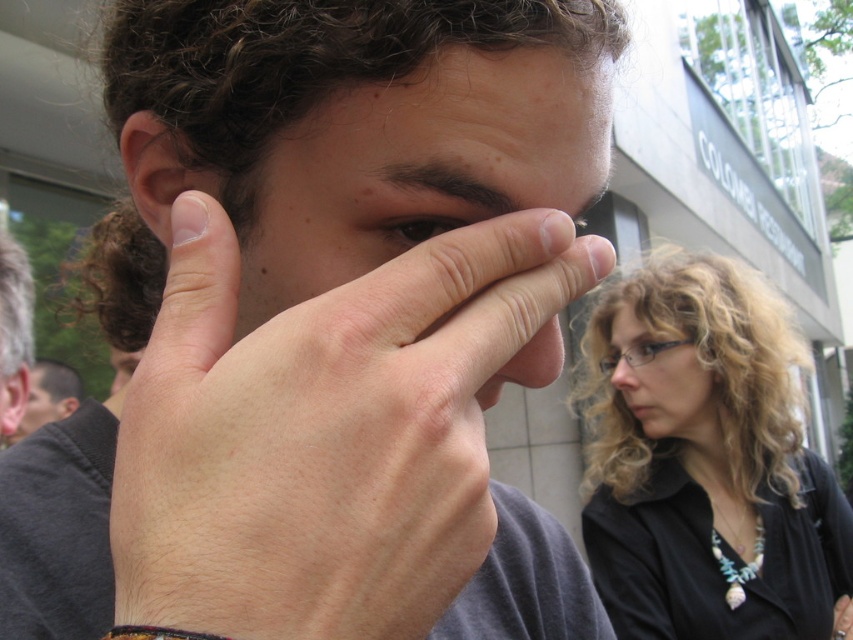
You are a photographer trying to capture a clear shot of the smooth skin face at lower right and the gray hair at left. Based on their sizes in the frame, which one would you need to zoom in more on to get a detailed closeup?

The smooth skin face at lower right has a smaller size compared to gray hair at left, so you would need to zoom in more on the smooth skin face at lower right to get a detailed closeup.